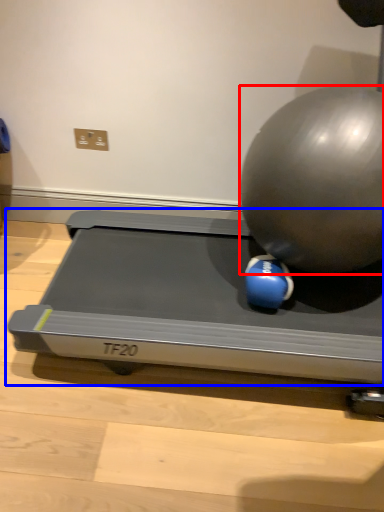
Question: Which point is closer to the camera, ball (highlighted by a red box) or treadmill (highlighted by a blue box)?

Choices:
 (A) ball
 (B) treadmill

Answer: (A)